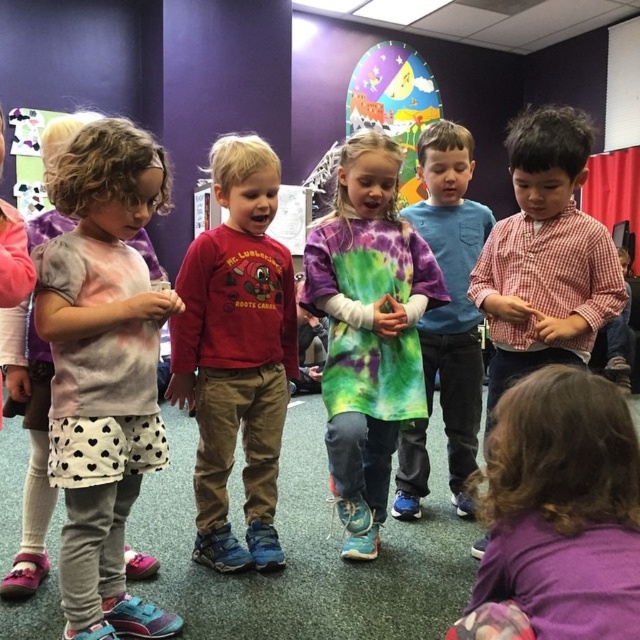
Question: Which point is farther to the camera?

Choices:
 (A) (289, 269)
 (B) (557, 268)
 (C) (509, 392)
 (D) (422, 346)

Answer: (D)

Question: Which point appears farthest from the camera in this image?

Choices:
 (A) (596, 310)
 (B) (140, 624)
 (C) (512, 401)

Answer: (A)

Question: Is red cotton shirt at center smaller than checkered fabric shirt at right?

Choices:
 (A) no
 (B) yes

Answer: (B)

Question: Can you confirm if light pink tie-dye shirt at left is thinner than red cotton shirt at center?

Choices:
 (A) yes
 (B) no

Answer: (A)

Question: Is red cotton shirt at center further to the viewer compared to tie-dye fabric dress at center?

Choices:
 (A) no
 (B) yes

Answer: (A)

Question: Which object is farther from the camera taking this photo?

Choices:
 (A) checkered fabric shirt at right
 (B) red cotton shirt at center
 (C) tie-dye fabric dress at center

Answer: (C)